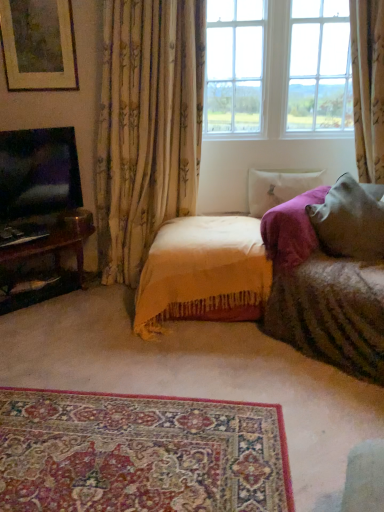
Identify the location of free space above carpet with intricate patterns at lower center (from a real-world perspective). Image resolution: width=384 pixels, height=512 pixels. (130, 435).